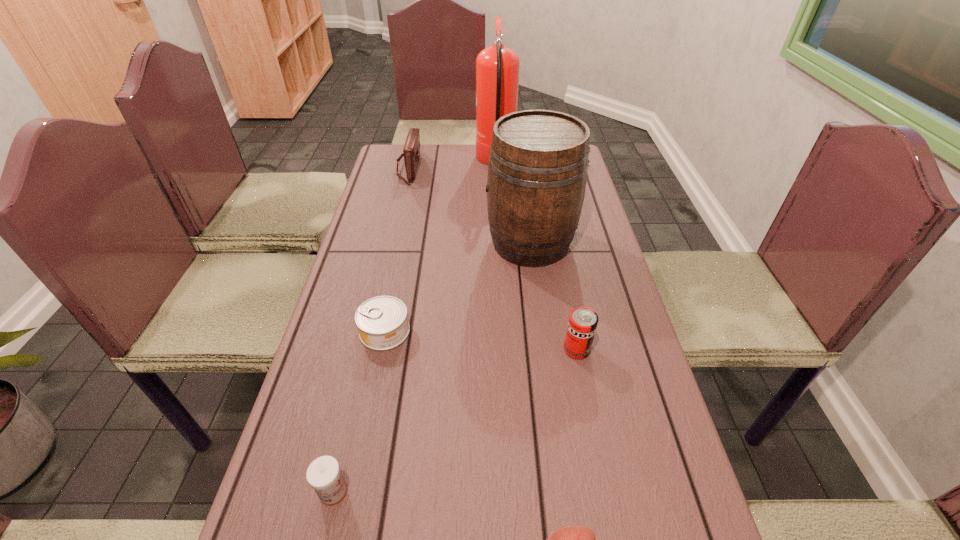
The image size is (960, 540). Find the location of `shoulder bag that is positioned at the far edge`. shoulder bag that is positioned at the far edge is located at coordinates (411, 151).

In order to click on shoulder bag present at the left edge in this screenshot , I will do `click(411, 151)`.

Image resolution: width=960 pixels, height=540 pixels. Find the location of `medicine that is at the left edge`. medicine that is at the left edge is located at coordinates (323, 474).

Image resolution: width=960 pixels, height=540 pixels. I want to click on can that is at the left edge, so click(x=382, y=322).

Where is `cider located in the right edge section of the desktop`? This screenshot has width=960, height=540. cider located in the right edge section of the desktop is located at coordinates (538, 162).

The width and height of the screenshot is (960, 540). I want to click on can that is at the right edge, so click(583, 321).

You are a GUI agent. You are given a task and a screenshot of the screen. Output one action in this format:
    pyautogui.click(x=<x>, y=<y>)
    Task: Click on the object that is at the far left corner
    This screenshot has width=960, height=540.
    Given the screenshot: What is the action you would take?
    pyautogui.click(x=411, y=151)

Identify the location of free space at the far edge of the desktop. (436, 158).

The height and width of the screenshot is (540, 960). I want to click on free space at the left edge of the desktop, so click(x=397, y=205).

The height and width of the screenshot is (540, 960). Find the location of `free space at the right edge of the desktop`. free space at the right edge of the desktop is located at coordinates (684, 525).